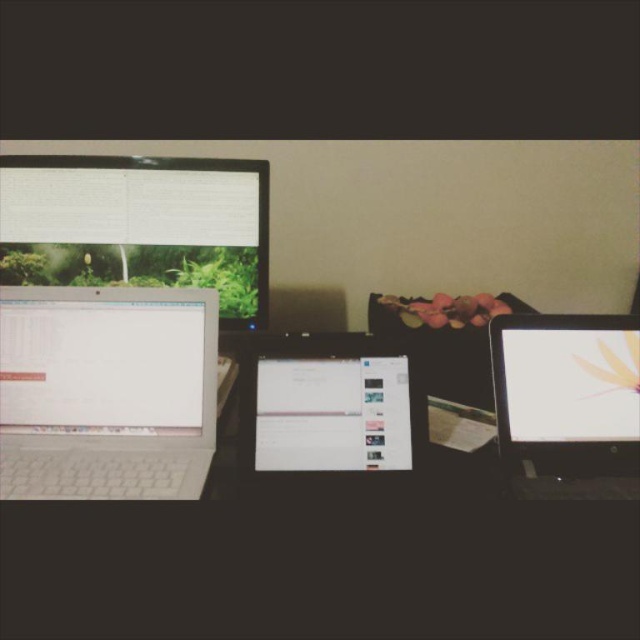
Does white glossy monitor at right appear on the right side of white glossy tablet at center?

Indeed, white glossy monitor at right is positioned on the right side of white glossy tablet at center.

Which is behind, point (516, 442) or point (362, 410)?

Point (516, 442)

This screenshot has width=640, height=640. Find the location of `white glossy monitor at right`. white glossy monitor at right is located at coordinates (566, 394).

Can you confirm if matte plastic monitor at upper left is positioned above white glossy tablet at center?

Yes.

Does matte plastic monitor at upper left have a lesser width compared to white glossy tablet at center?

Incorrect, matte plastic monitor at upper left's width is not less than white glossy tablet at center's.

Locate an element on the screen. matte plastic monitor at upper left is located at coordinates (140, 225).

Can you confirm if white plastic laptop at left is shorter than white glossy tablet at center?

No.

Between white plastic laptop at left and white glossy tablet at center, which one appears on the left side from the viewer's perspective?

white plastic laptop at left is more to the left.

What do you see at coordinates (106, 392) in the screenshot? The width and height of the screenshot is (640, 640). I see `white plastic laptop at left` at bounding box center [106, 392].

I want to click on white plastic laptop at left, so click(106, 392).